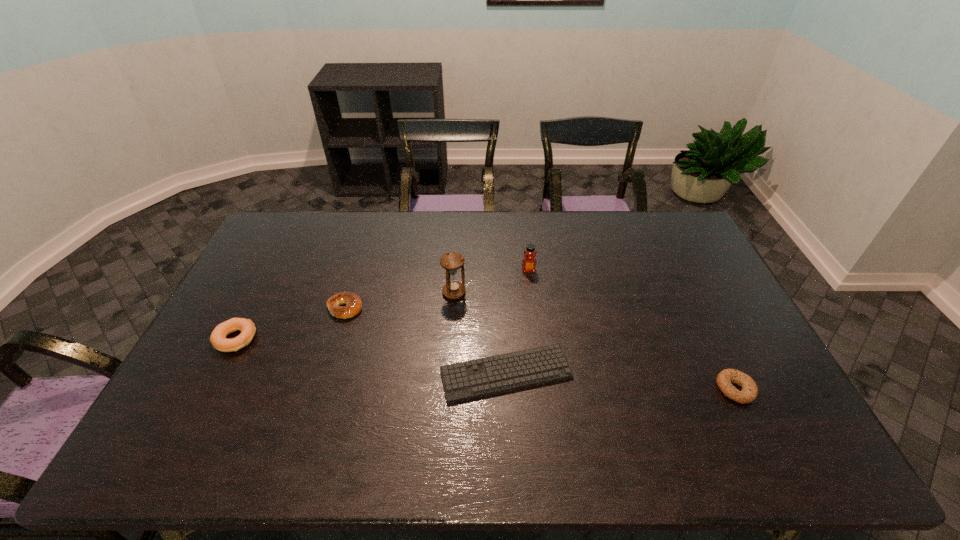
In order to click on vacant space located 0.270m on the left of the hourglass in this screenshot , I will do pyautogui.click(x=360, y=293).

You are a GUI agent. You are given a task and a screenshot of the screen. Output one action in this format:
    pyautogui.click(x=<x>, y=<y>)
    Task: Click on the vacant point located 0.180m on the front label of the farthest object
    The height and width of the screenshot is (540, 960).
    Given the screenshot: What is the action you would take?
    pyautogui.click(x=534, y=314)

Locate an element on the screen. This screenshot has width=960, height=540. vacant space located on the back of the leftmost object is located at coordinates (273, 267).

I want to click on vacant region located 0.230m on the back of the fifth object from right to left, so click(x=363, y=251).

Identify the location of vacant space located 0.380m on the left of the nearest bagel. The height and width of the screenshot is (540, 960). (574, 389).

In order to click on free space located on the right of the shortest object in this screenshot , I will do `click(707, 374)`.

Where is `object at the left edge`? object at the left edge is located at coordinates (218, 336).

Image resolution: width=960 pixels, height=540 pixels. I want to click on object that is at the right edge, so click(749, 391).

Locate an element on the screen. free region at the far edge is located at coordinates (588, 244).

You are a GUI agent. You are given a task and a screenshot of the screen. Output one action in this format:
    pyautogui.click(x=<x>, y=<y>)
    Task: Click on the vacant space at the near edge
    This screenshot has width=960, height=540.
    Given the screenshot: What is the action you would take?
    pyautogui.click(x=729, y=453)